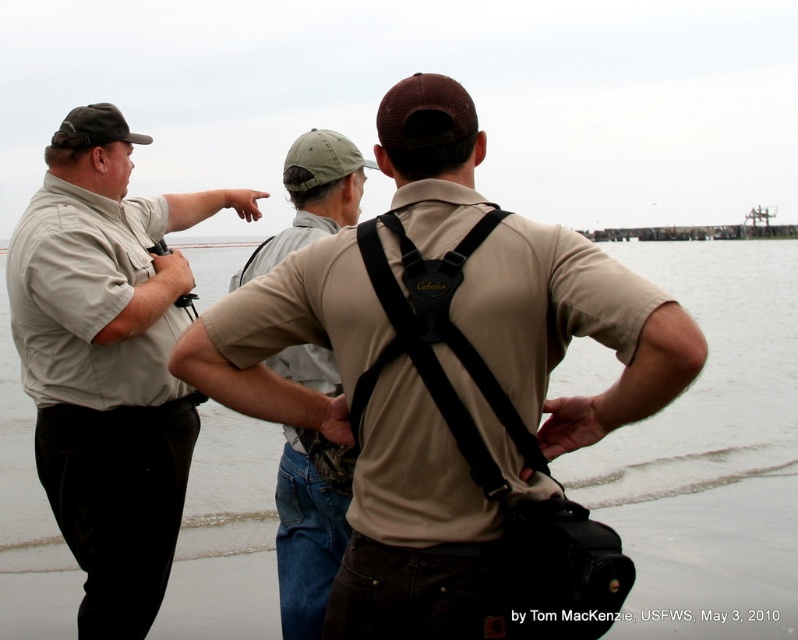
Question: Does tan fabric shirt at center have a larger size compared to matte khaki shirt at left?

Choices:
 (A) yes
 (B) no

Answer: (B)

Question: Considering the real-world distances, which object is closest to the khaki cotton shirt at center?

Choices:
 (A) matte khaki shirt at left
 (B) tan fabric shirt at center

Answer: (A)

Question: Based on their relative distances, which object is farther from the matte khaki shirt at left?

Choices:
 (A) tan fabric shirt at center
 (B) khaki cotton shirt at center

Answer: (A)

Question: Does tan fabric shirt at center lie in front of matte khaki shirt at left?

Choices:
 (A) yes
 (B) no

Answer: (A)

Question: Does tan fabric shirt at center lie in front of khaki cotton shirt at center?

Choices:
 (A) no
 (B) yes

Answer: (B)

Question: Among these objects, which one is farthest from the camera?

Choices:
 (A) tan fabric shirt at center
 (B) khaki cotton shirt at center

Answer: (B)